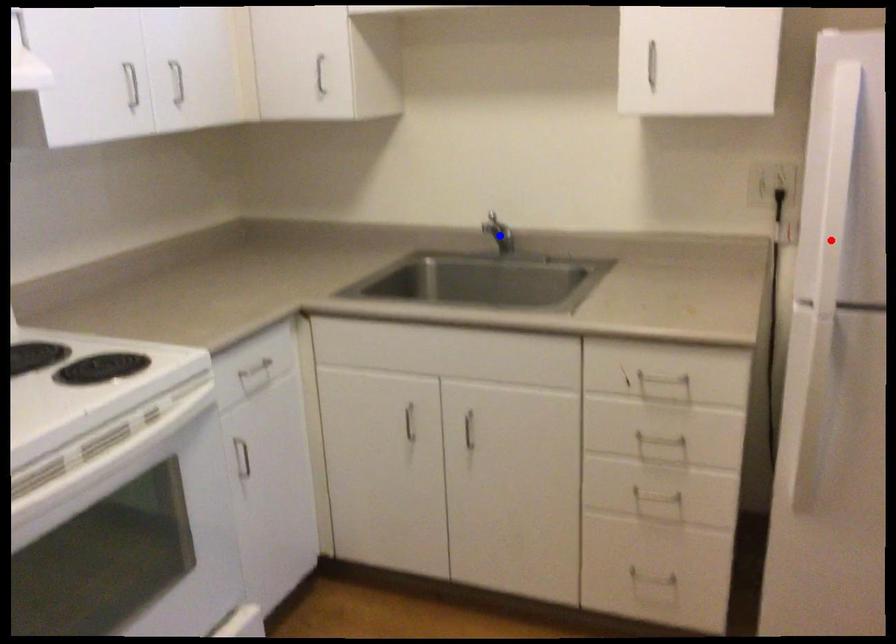
Question: Two points are marked on the image. Which point is closer to the camera?

Choices:
 (A) Blue point is closer.
 (B) Red point is closer.

Answer: (B)